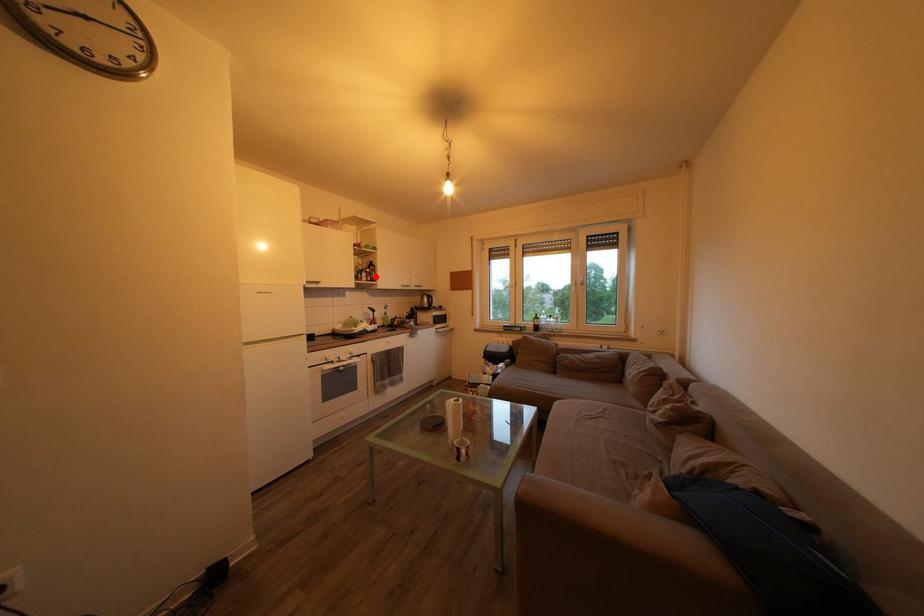
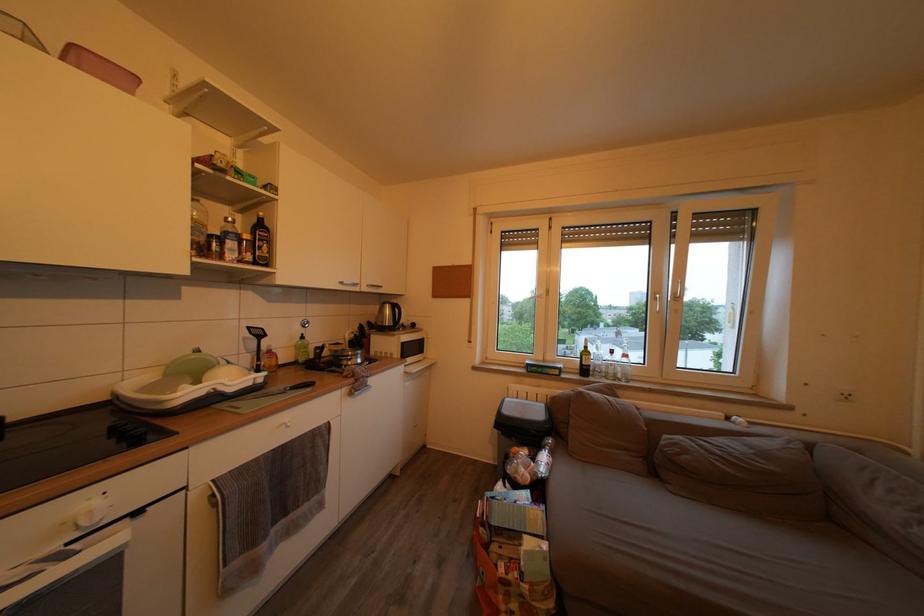
Where in the second image is the point corresponding to the highlighted location from the first image?

(253, 243)